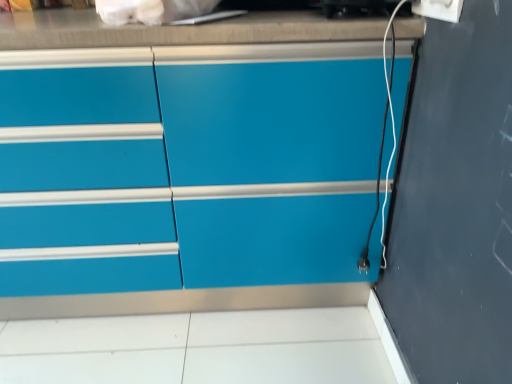
Question: From a real-world perspective, is white plastic electric outlet at upper right above or below matte blue cabinet at center?

Choices:
 (A) above
 (B) below

Answer: (A)

Question: Considering the positions of white plastic electric outlet at upper right and matte blue cabinet at center in the image, is white plastic electric outlet at upper right taller or shorter than matte blue cabinet at center?

Choices:
 (A) tall
 (B) short

Answer: (B)

Question: In terms of size, does white plastic electric outlet at upper right appear bigger or smaller than matte blue cabinet at center?

Choices:
 (A) small
 (B) big

Answer: (A)

Question: In the image, is matte blue cabinet at center positioned in front of or behind white plastic electric outlet at upper right?

Choices:
 (A) front
 (B) behind

Answer: (B)

Question: From a real-world perspective, is matte blue cabinet at center positioned above or below white plastic electric outlet at upper right?

Choices:
 (A) below
 (B) above

Answer: (A)

Question: Looking at their shapes, would you say matte blue cabinet at center is wider or thinner than white plastic electric outlet at upper right?

Choices:
 (A) thin
 (B) wide

Answer: (B)

Question: Do you think matte blue cabinet at center is within white plastic electric outlet at upper right, or outside of it?

Choices:
 (A) outside
 (B) inside

Answer: (A)